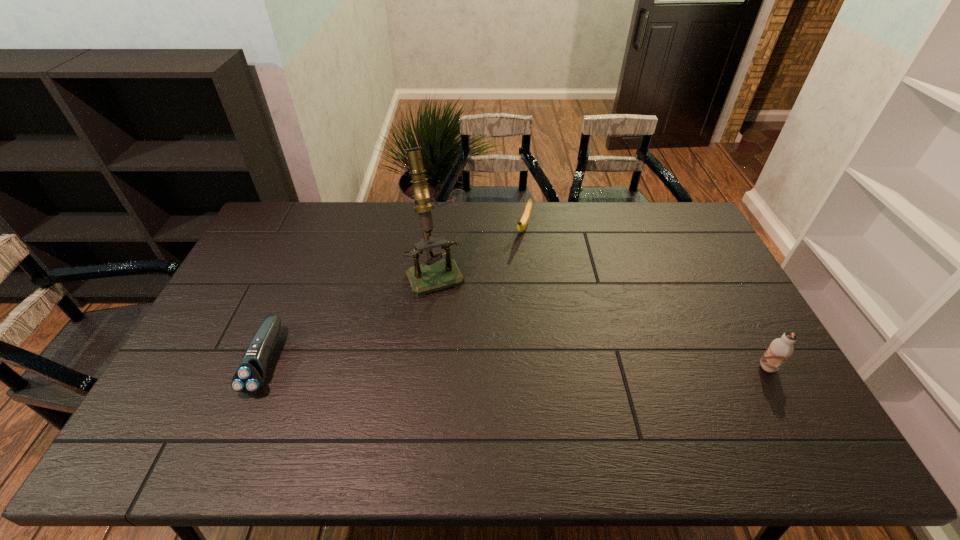
Where is `the leftmost object`? The height and width of the screenshot is (540, 960). the leftmost object is located at coordinates click(250, 376).

This screenshot has width=960, height=540. I want to click on chocolate milk, so click(x=780, y=349).

Locate an element on the screen. The height and width of the screenshot is (540, 960). the third shortest object is located at coordinates (780, 349).

This screenshot has height=540, width=960. I want to click on the farthest object, so click(522, 224).

Identify the location of banana. The height and width of the screenshot is (540, 960). (522, 224).

Identify the location of the tallest object. click(436, 274).

In order to click on the third nearest object in this screenshot , I will do `click(436, 274)`.

Locate an element on the screen. This screenshot has height=540, width=960. free space located 0.130m on the back of the chocolate milk is located at coordinates (743, 323).

At what (x,y) coordinates should I click in order to perform the action: click on vacant space located 0.310m at the stem of the third object from left to right. Please return your answer as a coordinate pair (x, y). The height and width of the screenshot is (540, 960). Looking at the image, I should click on coord(497,301).

Find the location of a particular element. The height and width of the screenshot is (540, 960). vacant space situated 0.220m at the stem of the third object from left to right is located at coordinates (506, 282).